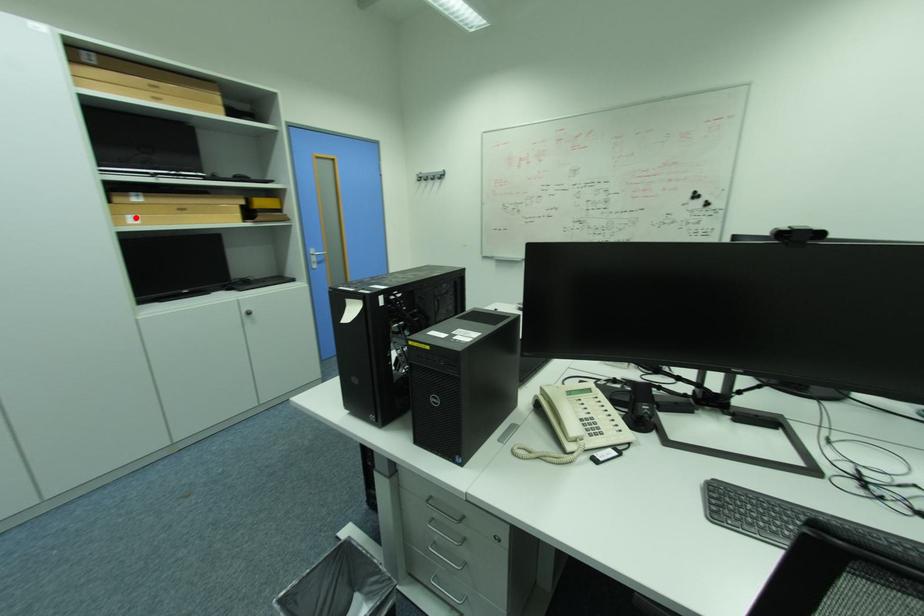
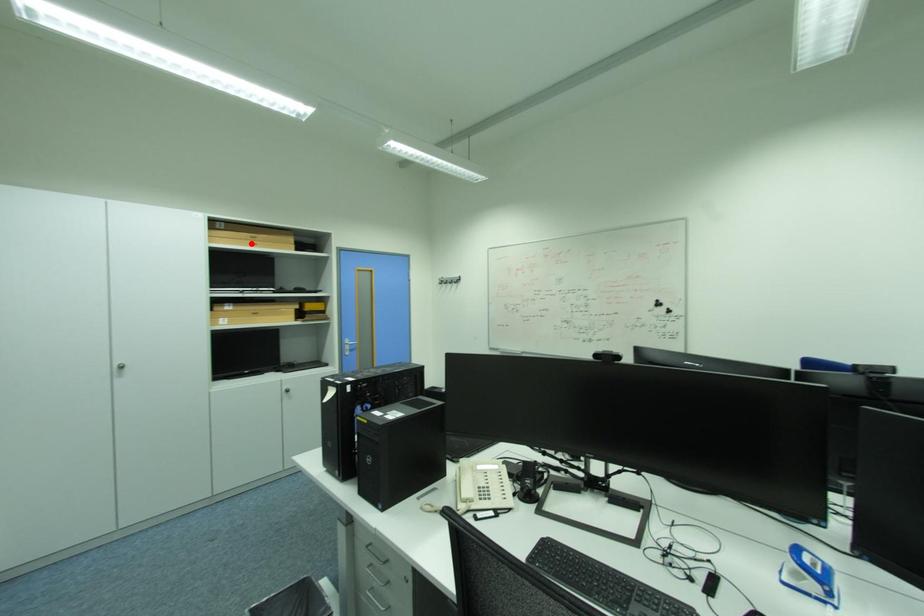
I am providing you with two images of the same scene from different viewpoints. A red point is marked on the first image and another point is marked on the second image. Are the points marked in image1 and image2 representing the same 3D position?

No